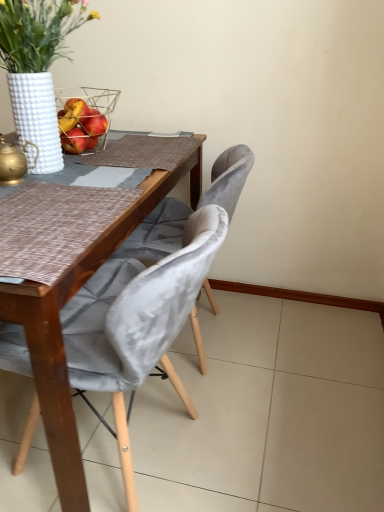
Where is `vacant space to the right of metallic wire picnic basket at upper left`? Image resolution: width=384 pixels, height=512 pixels. vacant space to the right of metallic wire picnic basket at upper left is located at coordinates (142, 150).